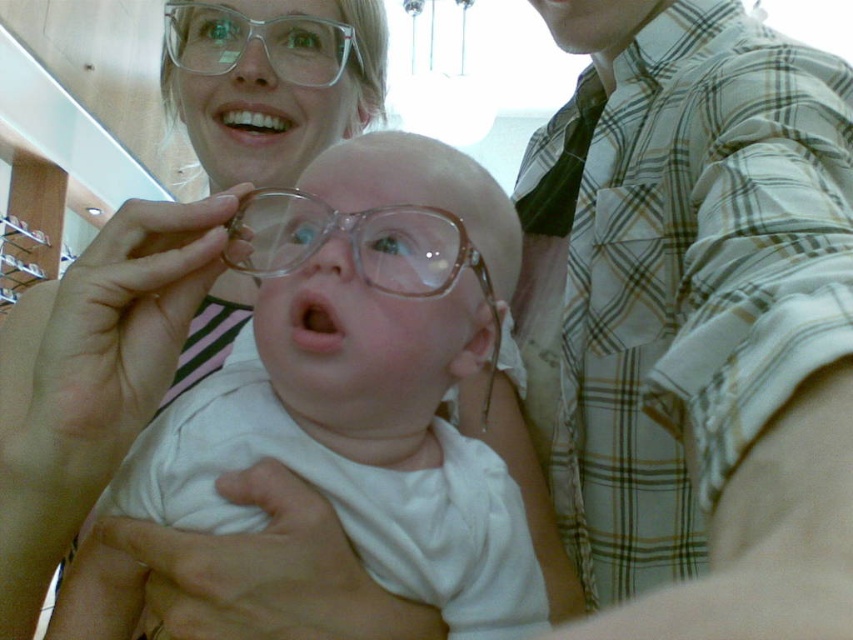
You are a photographer trying to capture a closeup of the baby in the image. You need to focus on the white glossy teeth at upper center while ensuring the plaid shirt at right is still in frame. Given their sizes, can you fit both in the shot without zooming in too much?

The plaid shirt at right is bigger than white glossy teeth at upper center, so it should be possible to focus on the white glossy teeth at upper center while keeping the plaid shirt at right in the frame without excessive zooming.

You are a photographer trying to capture a candid shot of the scene. You want to focus on the white glossy teeth at upper center and the plaid shirt at right. Based on their positions, which object should you adjust your camera to prioritize in the foreground?

The white glossy teeth at upper center should be prioritized in the foreground since the plaid shirt at right is located below it, meaning the white glossy teeth at upper center is closer to the camera.

Based on the photo, you are a photographer trying to capture a closeup of the pink glossy lips at center. The clear plastic glasses at upper center is blocking your view. Can you move the glasses to the side to get a clear shot?

The clear plastic glasses at upper center is further to the viewer than pink glossy lips at center, so yes, you can move the glasses to the side to get a clear shot of the pink glossy lips at center.